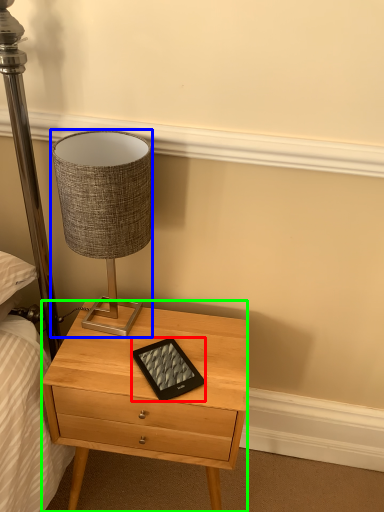
Question: Which is farther away from tablet computer (highlighted by a red box)? lamp (highlighted by a blue box) or nightstand (highlighted by a green box)?

Choices:
 (A) lamp
 (B) nightstand

Answer: (A)